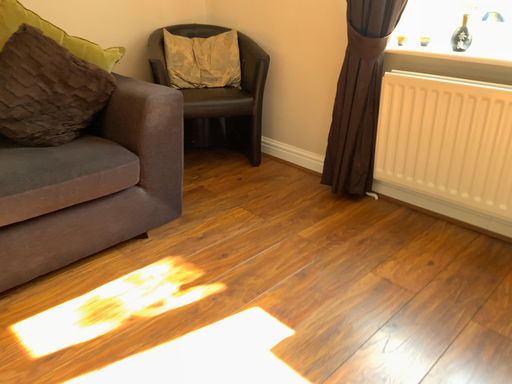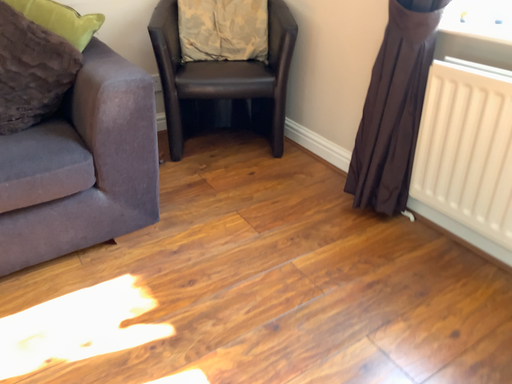
Question: Which way did the camera rotate in the video?

Choices:
 (A) rotated left
 (B) rotated right

Answer: (A)